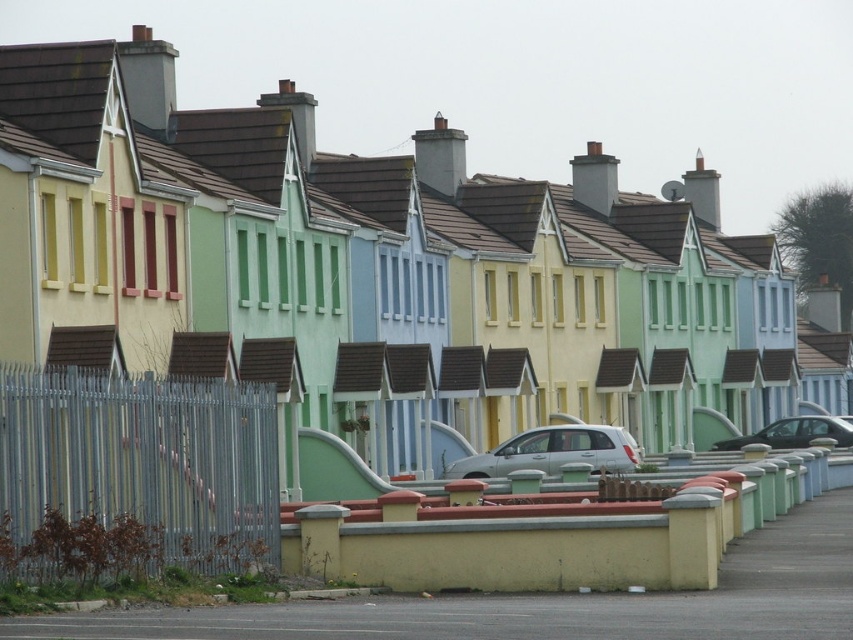
You are standing in front of the row of colorful terraced houses. There is a metallic silver fence at left. Where is the metallic silver fence located in relation to the houses?

The metallic silver fence at left is located at the left side of the houses, based on its 2D coordinates at point (135, 474).

You are a delivery person trying to park a van that is 5 meters long. You see the white matte car at center and the shiny black car at center parked in the parking spot. Can you fit your van between them?

The white matte car at center is larger in size than the shiny black car at center, but the exact distance between them is not provided. Without knowing the space between the two cars, it is impossible to determine if the van can fit.